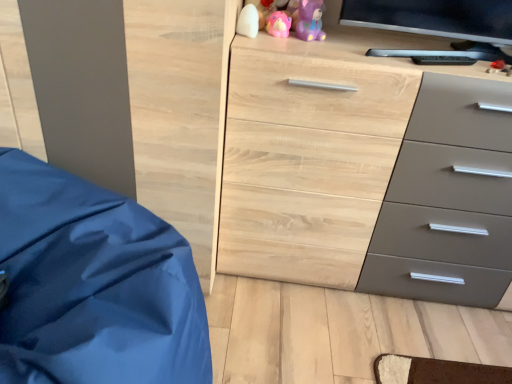
At what (x,y) coordinates should I click in order to perform the action: click on vacant area that is in front of white matte pillow at upper center, which appears as the 1th toy when viewed from the left. Please return your answer as a coordinate pair (x, y). Looking at the image, I should click on (254, 41).